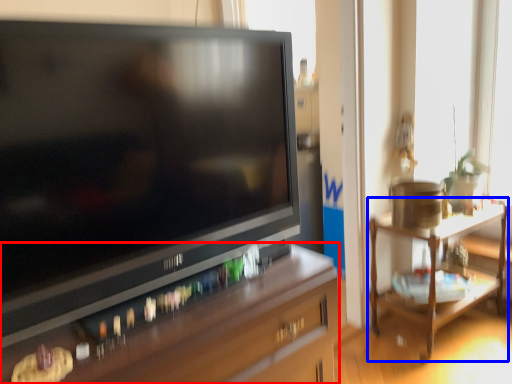
Question: Which object appears closest to the camera in this image, desk (highlighted by a red box) or table (highlighted by a blue box)?

Choices:
 (A) desk
 (B) table

Answer: (A)